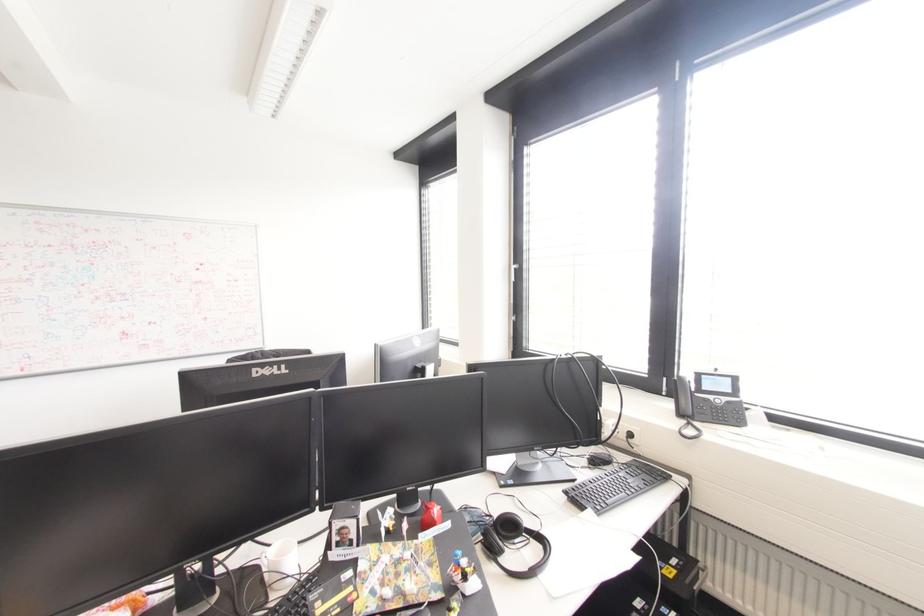
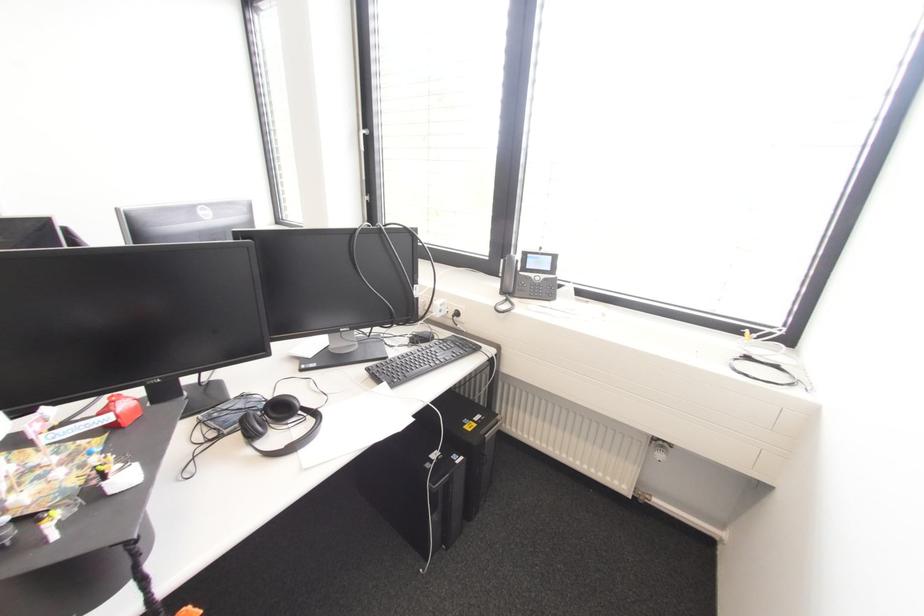
In the second image, find the point that corresponds to point 679,415 in the first image.

(503, 292)